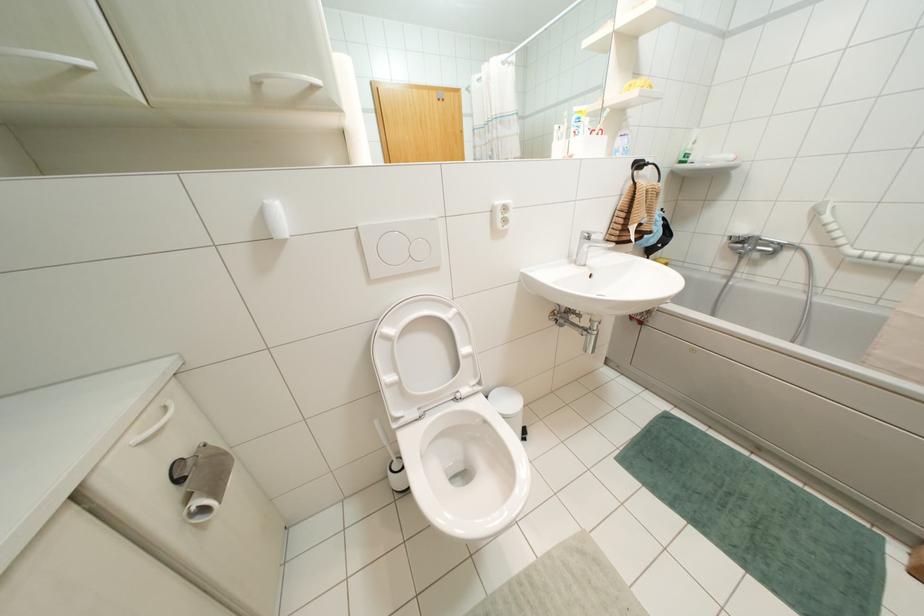
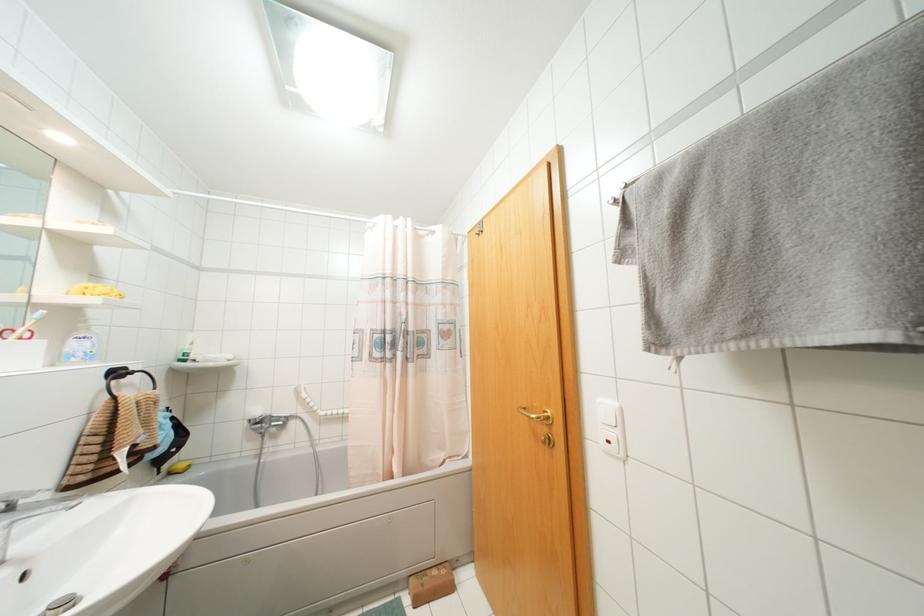
Where in the second image is the point corresponding to the point at 608,110 from the first image?

(42, 310)